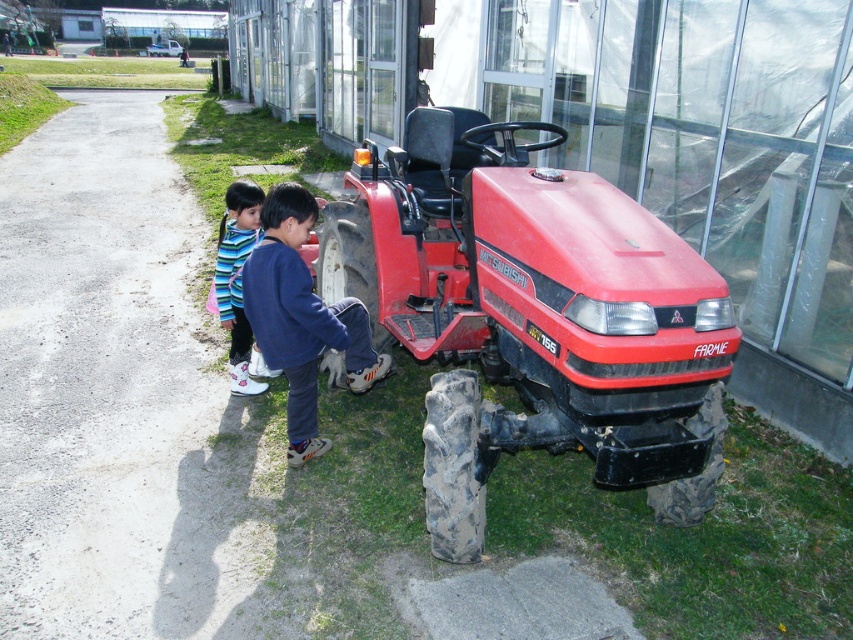
You are a visitor at the greenhouse and see the red matte tractor at center and the striped fabric shoes at lower left. Which object is closer to the entrance of the greenhouse?

The striped fabric shoes at lower left are closer to the entrance of the greenhouse because the red matte tractor at center is to the right of them, implying the shoes are positioned between the entrance and the tractor.

You are a photographer setting up a shot of the blue fleece jacket at center and the striped fabric shoes at lower left. Which object should you focus on first if you want to capture both in the same frame without moving the camera?

Result: The blue fleece jacket at center is bigger than the striped fabric shoes at lower left, so you should focus on the blue fleece jacket at center first to ensure it is in sharp focus while the shoes will still be in the frame but slightly smaller.

Looking at this image, you are a parent supervising the children in the greenhouse area. The red matte tractor at center is parked near the path. Can you determine if the striped fabric shoes at lower left are within a safe distance of 4 feet from the tractor?

The red matte tractor at center and striped fabric shoes at lower left are 3.91 feet apart, which is within the 4 feet safety distance. The striped fabric shoes at lower left are close to the tractor.